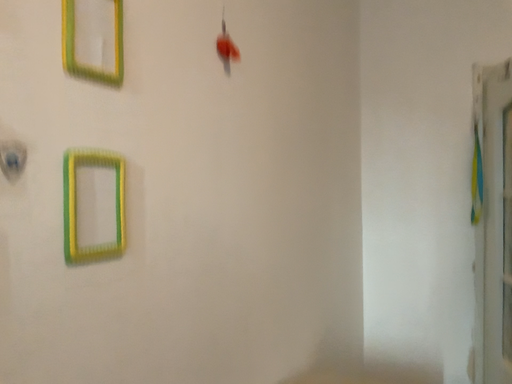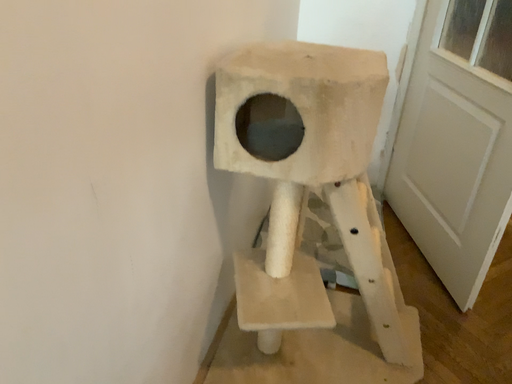
Question: How did the camera likely rotate when shooting the video?

Choices:
 (A) rotated left
 (B) rotated right

Answer: (B)